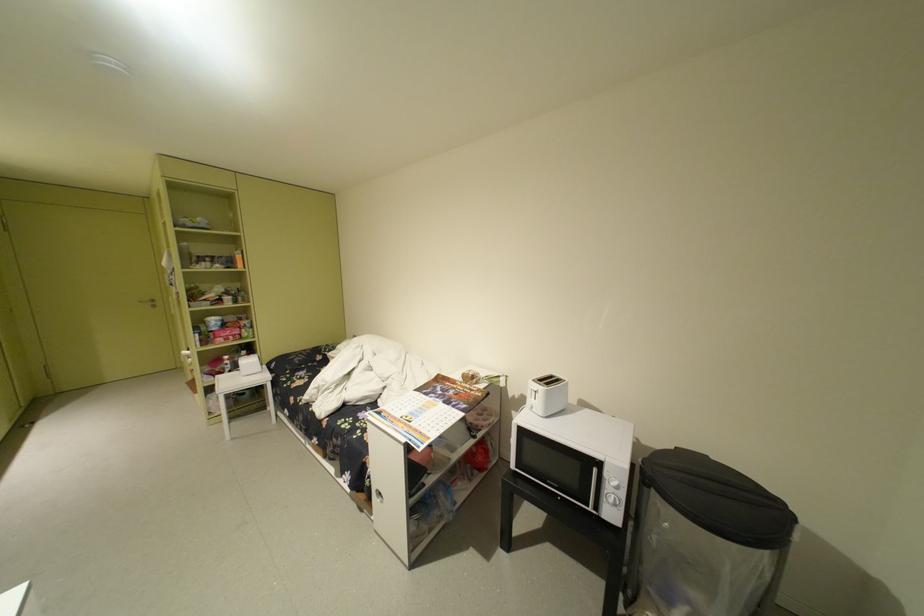
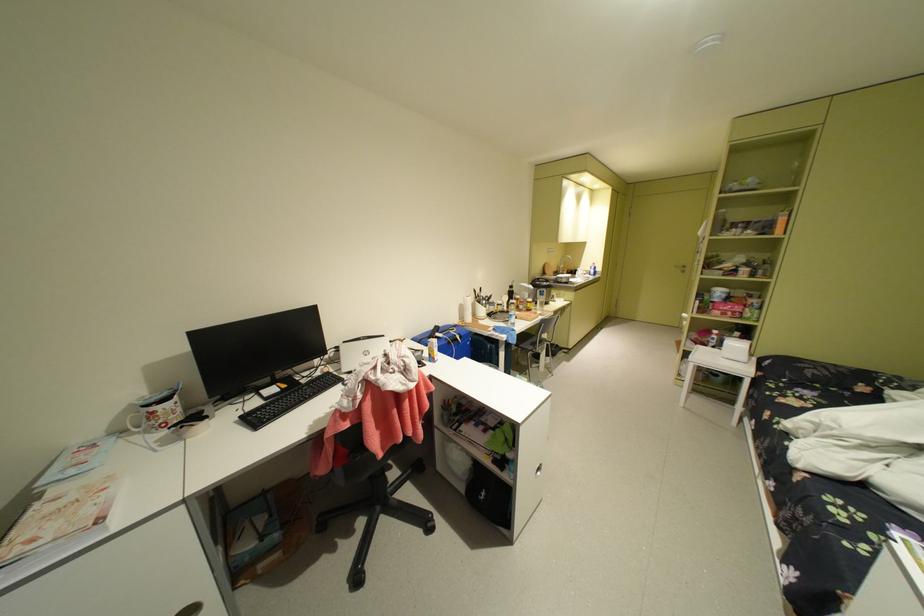
Where in the second image is the point corresponding to the point at 237,330 from the first image?

(740, 304)